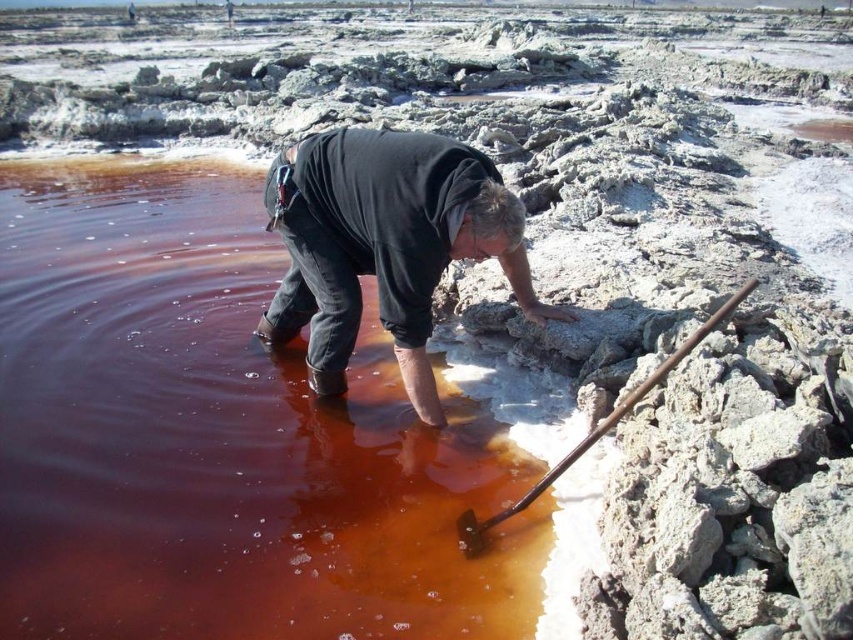
You are a photographer trying to capture the person working at the salt flats. You want to ensure that both the black cotton shirt at center and the rusty metal shovel at lower right are clearly visible in your photo. Based on their positions, which object should you focus on first to ensure both are in sharp focus?

The black cotton shirt at center is located above the rusty metal shovel at lower right. To ensure both are in sharp focus, you should focus on the black cotton shirt at center first since it is farther away and focusing on it will include the closer shovel within the depth of field.